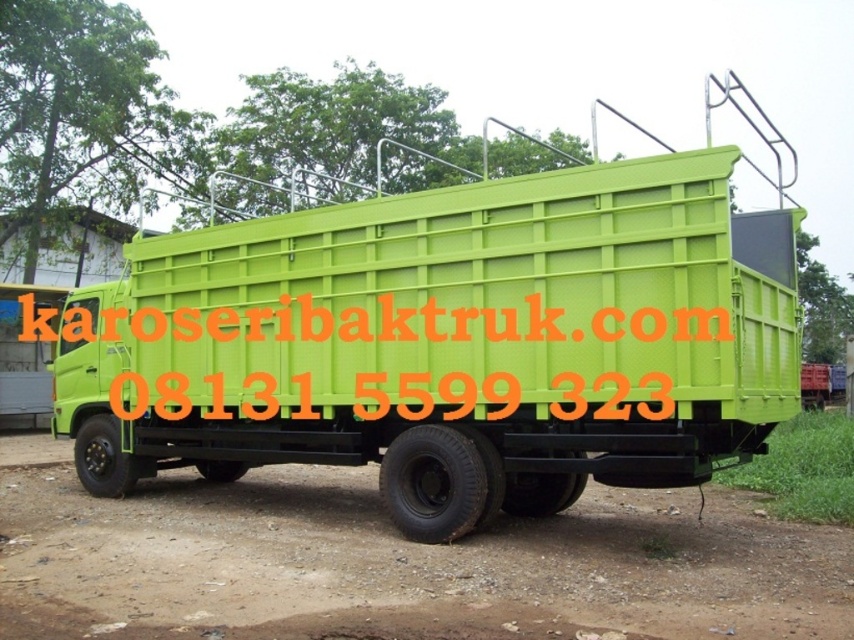
You are a delivery driver who needs to unload a package that requires a minimum clearance of 20 feet between the container and the text label. Can the green plastic container at center and green plastic text at center accommodate this requirement?

The distance between the green plastic container at center and green plastic text at center is 22.73 feet, which exceeds the required 20 feet clearance. Therefore, the package can be safely unloaded here.

You are standing at the center of the image and see the green plastic container at center. If you walk straight ahead, will you reach the container before encountering any obstacles?

The green plastic container at center is located at point (x=449, y=342), which is directly in front of you at the center of the image. Since there are no obstacles mentioned between you and the container, you will reach it without any hindrance.

You are a delivery driver who needs to place a green plastic container at center and a green plastic text at center on the flatbed of the dump truck. The flatbed has limited space. Which object should you place first to ensure both fit properly?

The green plastic container at center has a larger width than the green plastic text at center. To ensure both fit on the flatbed, place the larger green plastic container at center first, then the smaller green plastic text at center.